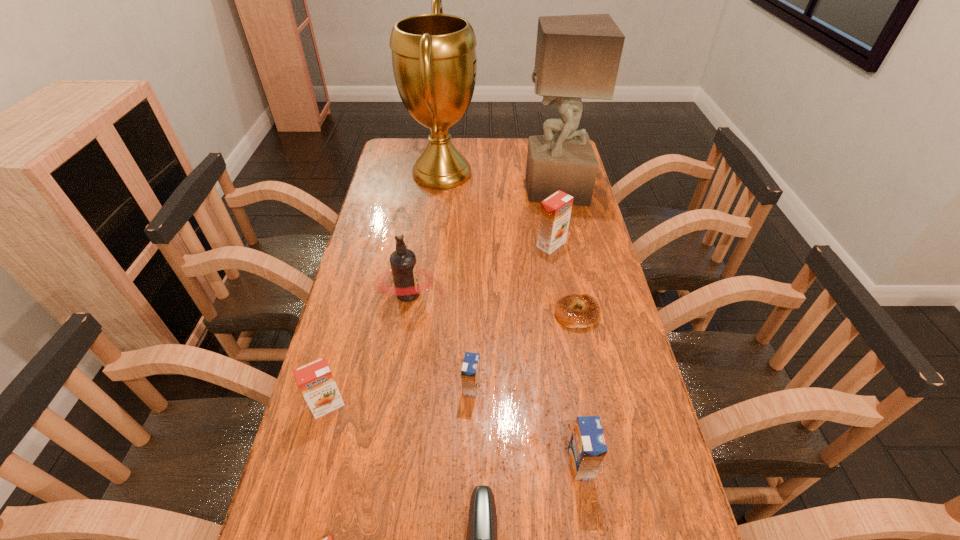
Identify the location of free space that satisfies the following two spatial constraints: 1. on the front-facing side of the gray sculpture; 2. on the front side of the right blue orange_juice. The width and height of the screenshot is (960, 540). (612, 464).